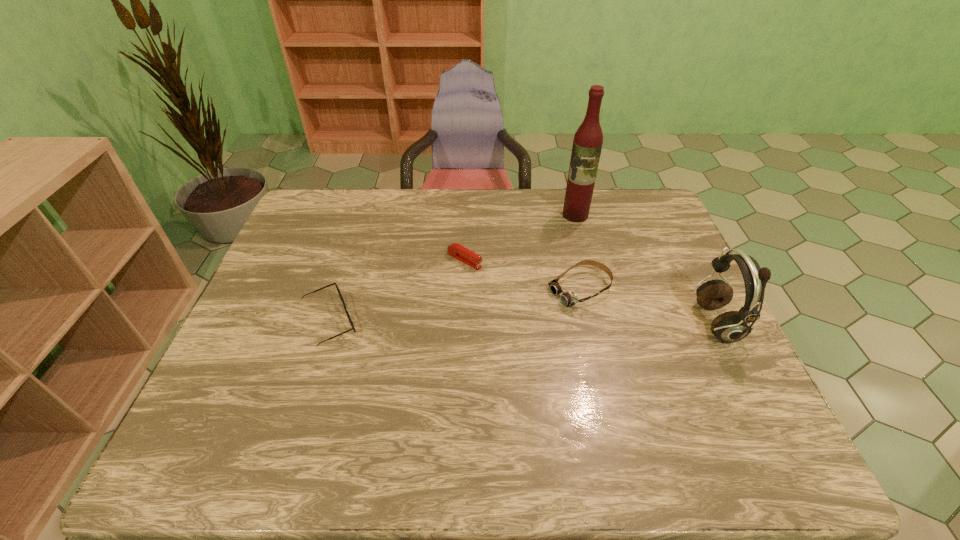
At what (x,y) coordinates should I click in order to perform the action: click on free space between the tallest object and the leftmost object. Please return your answer as a coordinate pair (x, y). Looking at the image, I should click on (452, 268).

Locate an element on the screen. The image size is (960, 540). empty space that is in between the second object from left to right and the rightmost object is located at coordinates (590, 292).

This screenshot has width=960, height=540. In order to click on free spot between the goggles and the fourth object from right to left in this screenshot , I will do `click(522, 275)`.

Where is `free space that is in between the rightmost object and the spectacles`? This screenshot has width=960, height=540. free space that is in between the rightmost object and the spectacles is located at coordinates (523, 323).

Identify the location of free spot between the liquor and the leftmost object. (452, 268).

Where is `free space between the goggles and the earphone`? The height and width of the screenshot is (540, 960). free space between the goggles and the earphone is located at coordinates (648, 307).

The image size is (960, 540). I want to click on vacant area between the farthest object and the leftmost object, so click(x=452, y=268).

Find the location of a particular element. This screenshot has width=960, height=540. object that is the fourth closest to the spectacles is located at coordinates (732, 326).

Locate an element on the screen. This screenshot has width=960, height=540. object that stands as the fourth closest to the rightmost object is located at coordinates (349, 318).

Find the location of a particular element. vacant area in the image that satisfies the following two spatial constraints: 1. on the front side of the rightmost object; 2. on the ear pads of the goggles is located at coordinates (588, 323).